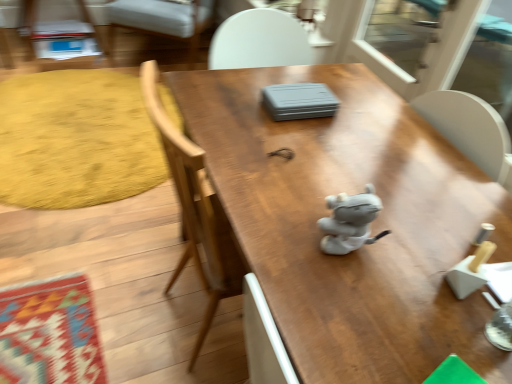
The width and height of the screenshot is (512, 384). Identify the location of wooden table at center. (372, 225).

What is the approximate width of wooden table at center?

wooden table at center is 31.83 inches in width.

The width and height of the screenshot is (512, 384). What are the coordinates of `wooden table at center` in the screenshot? It's located at (372, 225).

Looking at the image, does yellow textured rug at left seem bigger or smaller compared to wooden table at center?

Considering their sizes, yellow textured rug at left takes up less space than wooden table at center.

Is yellow textured rug at left turned away from wooden table at center?

No, yellow textured rug at left is not facing the opposite direction of wooden table at center.

From a real-world perspective, who is located lower, yellow textured rug at left or wooden table at center?

yellow textured rug at left, from a real-world perspective.

From a real-world perspective, which is physically below, white fabric chair at upper left or transparent plastic screen door at upper right?

white fabric chair at upper left is physically lower.

From the image's perspective, would you say white fabric chair at upper left is shown under transparent plastic screen door at upper right?

Result: No, from the image's perspective, white fabric chair at upper left is not below transparent plastic screen door at upper right.

What's the angular difference between white fabric chair at upper left and transparent plastic screen door at upper right's facing directions?

They differ by 54.4 degrees in their facing directions.

Is white fabric chair at upper left next to transparent plastic screen door at upper right?

There is a gap between white fabric chair at upper left and transparent plastic screen door at upper right.

How many degrees apart are the facing directions of white fabric chair at upper left and wooden table at center?

They differ by 56.3 degrees in their facing directions.

From the image's perspective, which is above, white fabric chair at upper left or wooden table at center?

white fabric chair at upper left, from the image's perspective.

Which of these two, white fabric chair at upper left or wooden table at center, stands shorter?

With less height is white fabric chair at upper left.

Is white fabric chair at upper left looking in the opposite direction of wooden table at center?

white fabric chair at upper left is not turned away from wooden table at center.

Is gray fabric toy at center shorter than transparent plastic screen door at upper right?

Indeed, gray fabric toy at center has a lesser height compared to transparent plastic screen door at upper right.

From a real-world perspective, which is physically below, gray fabric toy at center or transparent plastic screen door at upper right?

transparent plastic screen door at upper right is physically lower.

Where is `screen door located underneath the gray fabric toy at center (from a real-world perspective)`? This screenshot has height=384, width=512. screen door located underneath the gray fabric toy at center (from a real-world perspective) is located at coordinates (490, 61).

What's the angular difference between gray fabric toy at center and transparent plastic screen door at upper right's facing directions?

The angular difference between gray fabric toy at center and transparent plastic screen door at upper right is 56 degrees.

How far apart are transparent plastic screen door at upper right and gray fabric toy at center?

transparent plastic screen door at upper right is 10.01 feet from gray fabric toy at center.

Does transparent plastic screen door at upper right appear on the right side of gray fabric toy at center?

Yes, transparent plastic screen door at upper right is to the right of gray fabric toy at center.

Is transparent plastic screen door at upper right inside the boundaries of gray fabric toy at center, or outside?

transparent plastic screen door at upper right exists outside the volume of gray fabric toy at center.

Is transparent plastic screen door at upper right oriented away from gray fabric toy at center?

No, transparent plastic screen door at upper right is not facing away from gray fabric toy at center.

From their relative heights in the image, would you say yellow textured rug at left is taller or shorter than white fabric chair at upper left?

In the image, yellow textured rug at left appears to be shorter than white fabric chair at upper left.

Which is in front, yellow textured rug at left or white fabric chair at upper left?

Positioned in front is yellow textured rug at left.

From the picture: From a real-world perspective, which object rests below the other?

yellow textured rug at left is physically lower.

Who is bigger, yellow textured rug at left or white fabric chair at upper left?

With larger size is white fabric chair at upper left.

Based on the photo, does transparent plastic screen door at upper right contain white fabric chair at upper left?

No, white fabric chair at upper left is not a part of transparent plastic screen door at upper right.

Which of these two, transparent plastic screen door at upper right or white fabric chair at upper left, stands taller?

With more height is white fabric chair at upper left.

Is transparent plastic screen door at upper right turned away from white fabric chair at upper left?

No, transparent plastic screen door at upper right is not facing the opposite direction of white fabric chair at upper left.

Is transparent plastic screen door at upper right placed right next to white fabric chair at upper left?

No, transparent plastic screen door at upper right is not next to white fabric chair at upper left.

You are a GUI agent. You are given a task and a screenshot of the screen. Output one action in this format:
    pyautogui.click(x=<x>, y=<y>)
    Task: Click on the table in front of the yellow textured rug at left
    
    Given the screenshot: What is the action you would take?
    pyautogui.click(x=372, y=225)

The image size is (512, 384). Identify the location of screen door that is below the white fabric chair at upper left (from the image's perspective). (490, 61).

When comparing their distances from yellow textured rug at left, does wooden table at center or gray fabric toy at center seem closer?

wooden table at center lies closer to yellow textured rug at left than the other object.

Based on their spatial positions, is wooden table at center or transparent plastic screen door at upper right closer to white fabric chair at upper left?

wooden table at center is closer to white fabric chair at upper left.

When comparing their distances from yellow textured rug at left, does transparent plastic screen door at upper right or white fabric chair at upper left seem further?

transparent plastic screen door at upper right.

Looking at this image, when comparing their distances from yellow textured rug at left, does gray fabric toy at center or transparent plastic screen door at upper right seem closer?

Based on the image, gray fabric toy at center appears to be nearer to yellow textured rug at left.

Looking at the image, which one is located closer to yellow textured rug at left, transparent plastic screen door at upper right or gray fabric toy at center?

gray fabric toy at center lies closer to yellow textured rug at left than the other object.

Based on their spatial positions, is gray fabric toy at center or yellow textured rug at left closer to transparent plastic screen door at upper right?

yellow textured rug at left is positioned closer to the anchor transparent plastic screen door at upper right.

When comparing their distances from gray fabric toy at center, does yellow textured rug at left or transparent plastic screen door at upper right seem further?

transparent plastic screen door at upper right is further to gray fabric toy at center.

Based on their spatial positions, is yellow textured rug at left or white fabric chair at upper left closer to transparent plastic screen door at upper right?

The object closer to transparent plastic screen door at upper right is white fabric chair at upper left.

Locate an element on the screen. The height and width of the screenshot is (384, 512). toy between wooden table at center and transparent plastic screen door at upper right is located at coordinates (350, 221).

Where is `toy between wooden table at center and white fabric chair at upper left along the z-axis`? toy between wooden table at center and white fabric chair at upper left along the z-axis is located at coordinates (350, 221).

The height and width of the screenshot is (384, 512). What are the coordinates of `toy situated between yellow textured rug at left and transparent plastic screen door at upper right from left to right` in the screenshot? It's located at (350, 221).

Where is `mat located between gray fabric toy at center and white fabric chair at upper left in the depth direction`? mat located between gray fabric toy at center and white fabric chair at upper left in the depth direction is located at coordinates (76, 140).